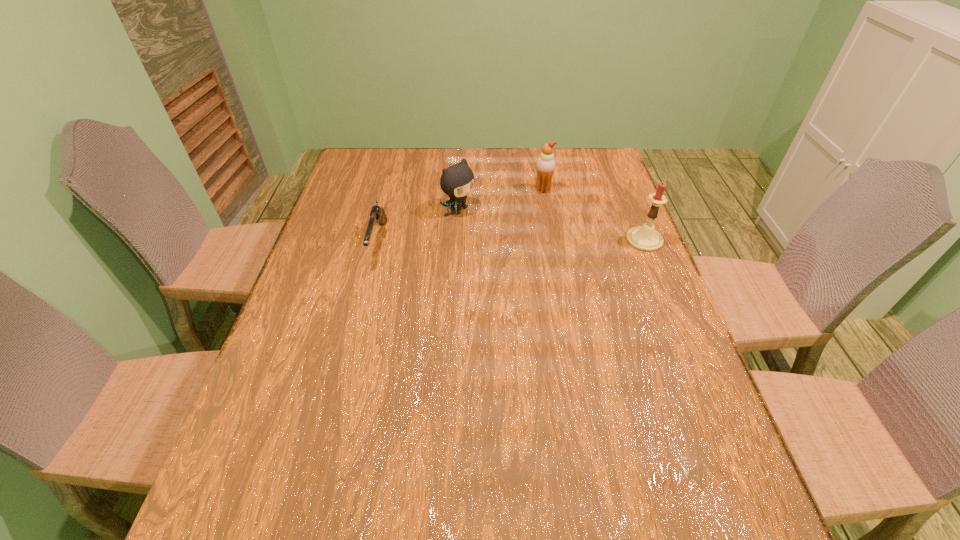
Find the location of a particular element. The image size is (960, 540). vacant space at the far right corner is located at coordinates (573, 163).

I want to click on free space that is in between the shortest object and the rightmost object, so click(512, 241).

Locate an element on the screen. The width and height of the screenshot is (960, 540). free space between the rightmost object and the icecream is located at coordinates (593, 215).

The width and height of the screenshot is (960, 540). Find the location of `unoccupied position between the icecream and the rightmost object`. unoccupied position between the icecream and the rightmost object is located at coordinates (593, 215).

I want to click on free area in between the rightmost object and the shortest object, so click(512, 241).

Locate an element on the screen. vacant space that's between the leftmost object and the kitten is located at coordinates (x=420, y=226).

At what (x,y) coordinates should I click in order to perform the action: click on empty space that is in between the icecream and the rightmost object. Please return your answer as a coordinate pair (x, y). The width and height of the screenshot is (960, 540). Looking at the image, I should click on (593, 215).

Where is `free space between the candle and the shortest object`? free space between the candle and the shortest object is located at coordinates (512, 241).

Locate an element on the screen. The width and height of the screenshot is (960, 540). free space between the second object from right to left and the shortest object is located at coordinates (461, 215).

This screenshot has width=960, height=540. Identify the location of vacant space that is in between the third object from left to right and the shortest object. (461, 215).